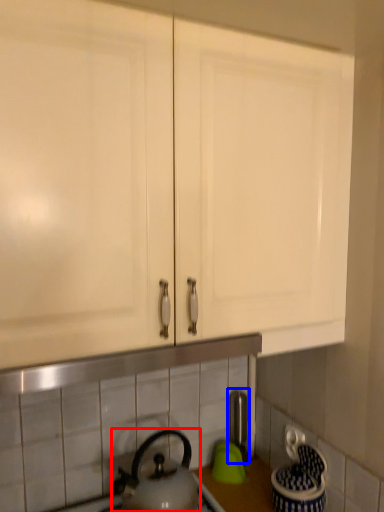
Question: Which object is closer to the camera taking this photo, kettle (highlighted by a red box) or faucet (highlighted by a blue box)?

Choices:
 (A) kettle
 (B) faucet

Answer: (A)